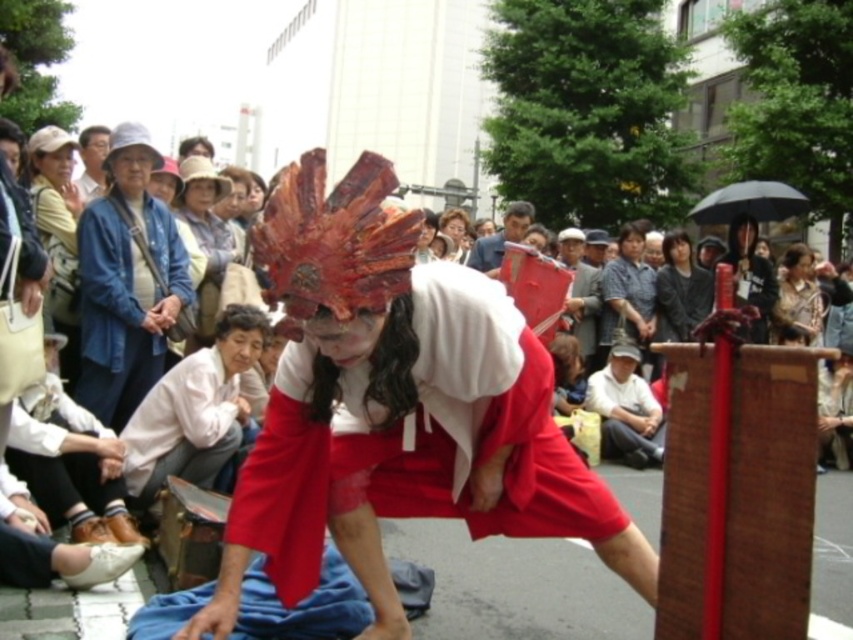
You are a photographer standing in the street. You want to take a photo of the matte red fabric costume at center without the blue denim jacket at upper left appearing in the frame. Is this possible based on their positions?

The matte red fabric costume at center is positioned under the blue denim jacket at upper left, so the blue denim jacket at upper left would likely block the view of the matte red fabric costume at center. To avoid the jacket in the photo, you might need to adjust your angle or position to ensure the jacket is out of the frame.

You are a photographer trying to capture the performer in the center. You notice the dark gray fabric at center and the matte blue shirt at upper left in your shot. Which object should you adjust your focus to ensure the performer is the main subject?

The dark gray fabric at center is much taller than the matte blue shirt at upper left, so adjusting focus on the dark gray fabric at center would help highlight the performer as the main subject since it is larger and central in the image.